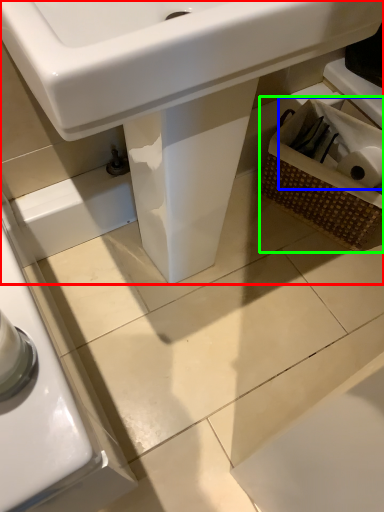
Question: Which object is the farthest from sink (highlighted by a red box)? Choose among these: toilet paper (highlighted by a blue box) or basket (highlighted by a green box).

Choices:
 (A) toilet paper
 (B) basket

Answer: (A)